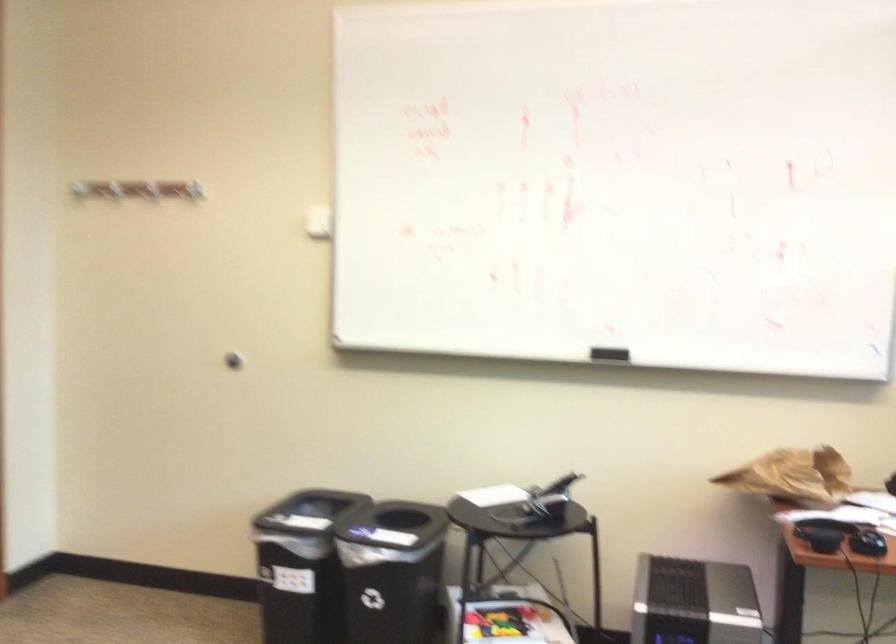
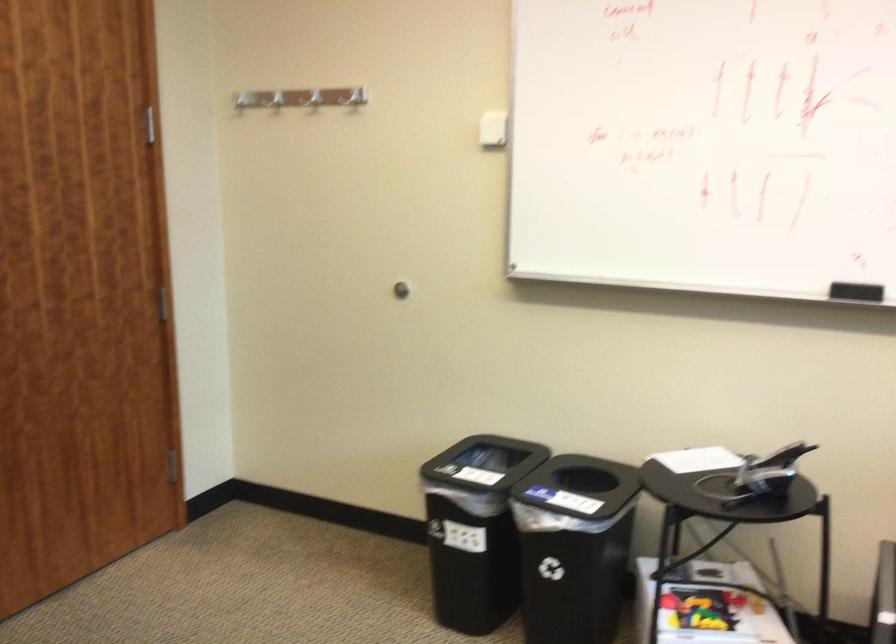
Locate, in the second image, the point that corresponds to pixel 562 488 in the first image.

(782, 456)